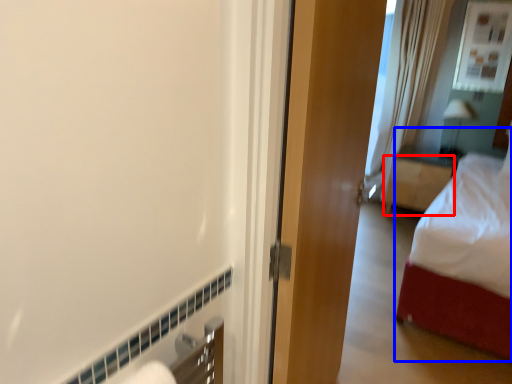
Question: Which object appears farthest to the camera in this image, furniture (highlighted by a red box) or bed (highlighted by a blue box)?

Choices:
 (A) furniture
 (B) bed

Answer: (A)